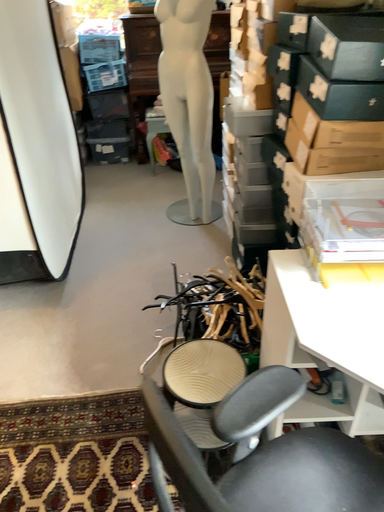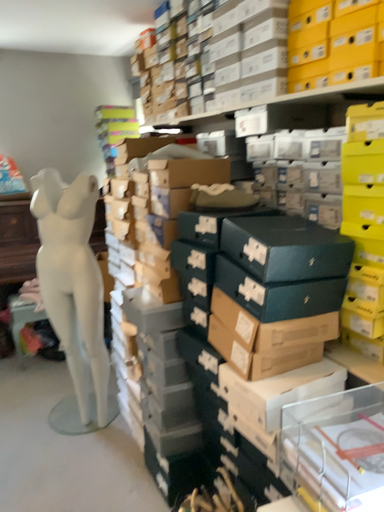
Question: Which way did the camera rotate in the video?

Choices:
 (A) rotated upward
 (B) rotated downward

Answer: (A)